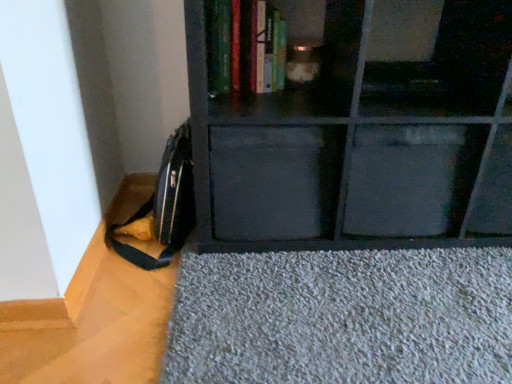
Find the location of `black matte drawer at center, positioned as the second drawer in right-to-left order`. black matte drawer at center, positioned as the second drawer in right-to-left order is located at coordinates (274, 181).

The height and width of the screenshot is (384, 512). In order to click on black matte drawer at center, positioned as the second drawer in right-to-left order in this screenshot , I will do `click(274, 181)`.

Who is taller, matte black shelf at center or black matte drawer at center, positioned as the first drawer in left-to-right order?

matte black shelf at center is taller.

From a real-world perspective, is matte black shelf at center positioned above or below black matte drawer at center, positioned as the second drawer in right-to-left order?

From a real-world perspective, matte black shelf at center is physically above black matte drawer at center, positioned as the second drawer in right-to-left order.

Choose the correct answer: Is matte black shelf at center inside black matte drawer at center, positioned as the second drawer in right-to-left order, or outside it?

The correct answer is: outside.

Considering the relative positions of matte black shelf at center and black matte drawer at center, positioned as the second drawer in right-to-left order, in the image provided, is matte black shelf at center to the right of black matte drawer at center, positioned as the second drawer in right-to-left order, from the viewer's perspective?

Yes, matte black shelf at center is to the right of black matte drawer at center, positioned as the second drawer in right-to-left order.

Is black matte drawer at center, positioned as the first drawer in left-to-right order, placed right next to hardcover book at upper center?

There is a gap between black matte drawer at center, positioned as the first drawer in left-to-right order, and hardcover book at upper center.

Does black matte drawer at center, positioned as the second drawer in right-to-left order, have a lesser height compared to hardcover book at upper center?

Incorrect, the height of black matte drawer at center, positioned as the second drawer in right-to-left order, does not fall short of that of hardcover book at upper center.

Does point (238, 130) appear closer or farther from the camera than point (226, 15)?

Point (238, 130) appears to be closer to the viewer than point (226, 15).

In the image, is black matte drawer at center, positioned as the second drawer in right-to-left order, on the left side or the right side of hardcover book at upper center?

black matte drawer at center, positioned as the second drawer in right-to-left order, is to the right of hardcover book at upper center.

Which is behind, hardcover book at upper center or metallic gray drawer at center, which is the second drawer in left-to-right order?

metallic gray drawer at center, which is the second drawer in left-to-right order.

Is hardcover book at upper center looking in the opposite direction of metallic gray drawer at center, which is the second drawer in left-to-right order?

No, hardcover book at upper center is not facing the opposite direction of metallic gray drawer at center, which is the second drawer in left-to-right order.

In the scene shown: Is hardcover book at upper center completely or partially outside of metallic gray drawer at center, arranged as the first drawer when viewed from the right?

hardcover book at upper center lies outside metallic gray drawer at center, arranged as the first drawer when viewed from the right,'s area.

Which object is closer to the camera, matte black shelf at center or hardcover book at upper center?

matte black shelf at center is in front.

From a real-world perspective, which object rests below the other?

matte black shelf at center.

Based on their positions, is matte black shelf at center located to the left or right of hardcover book at upper center?

From the image, it's evident that matte black shelf at center is to the right of hardcover book at upper center.

Does matte black shelf at center have a larger size compared to hardcover book at upper center?

Indeed, matte black shelf at center has a larger size compared to hardcover book at upper center.

In the scene shown: Which of these two, metallic gray drawer at center, arranged as the first drawer when viewed from the right, or matte black shelf at center, is wider?

matte black shelf at center is wider.

Are metallic gray drawer at center, arranged as the first drawer when viewed from the right, and matte black shelf at center located far from each other?

No.

Looking at this image, from a real-world perspective, is metallic gray drawer at center, arranged as the first drawer when viewed from the right, positioned above or below matte black shelf at center?

In terms of real-world spatial position, metallic gray drawer at center, arranged as the first drawer when viewed from the right, is below matte black shelf at center.

Considering the sizes of hardcover book at upper center and matte black shelf at center in the image, is hardcover book at upper center taller or shorter than matte black shelf at center?

Considering their sizes, hardcover book at upper center has less height than matte black shelf at center.

Which is more to the right, hardcover book at upper center or matte black shelf at center?

Positioned to the right is matte black shelf at center.

Where is `book behind the matte black shelf at center`? book behind the matte black shelf at center is located at coordinates (245, 47).

Is hardcover book at upper center oriented towards matte black shelf at center?

Yes, hardcover book at upper center is oriented towards matte black shelf at center.

Are matte black shelf at center and metallic gray drawer at center, arranged as the first drawer when viewed from the right, making contact?

matte black shelf at center and metallic gray drawer at center, arranged as the first drawer when viewed from the right, are clearly separated.

Locate an element on the screen. shelf above the metallic gray drawer at center, arranged as the first drawer when viewed from the right (from the image's perspective) is located at coordinates (360, 131).

Would you say matte black shelf at center is outside metallic gray drawer at center, which is the second drawer in left-to-right order?

Yes.

Is point (226, 154) positioned after point (454, 167)?

No, it is in front of (454, 167).

Locate an element on the screen. This screenshot has height=384, width=512. drawer that is the 1st object directly below the matte black shelf at center (from a real-world perspective) is located at coordinates (274, 181).

I want to click on drawer in front of the hardcover book at upper center, so click(274, 181).

Based on their spatial positions, is metallic gray drawer at center, arranged as the first drawer when viewed from the right, or hardcover book at upper center further from black matte drawer at center, positioned as the second drawer in right-to-left order?

hardcover book at upper center is further to black matte drawer at center, positioned as the second drawer in right-to-left order.

Looking at the image, which one is located further to metallic gray drawer at center, arranged as the first drawer when viewed from the right, matte black shelf at center or black matte drawer at center, positioned as the first drawer in left-to-right order?

Among the two, black matte drawer at center, positioned as the first drawer in left-to-right order, is located further to metallic gray drawer at center, arranged as the first drawer when viewed from the right.

Looking at the image, which one is located closer to hardcover book at upper center, metallic gray drawer at center, arranged as the first drawer when viewed from the right, or black matte drawer at center, positioned as the first drawer in left-to-right order?

Based on the image, black matte drawer at center, positioned as the first drawer in left-to-right order, appears to be nearer to hardcover book at upper center.

Estimate the real-world distances between objects in this image. Which object is closer to matte black shelf at center, hardcover book at upper center or black matte drawer at center, positioned as the first drawer in left-to-right order?

black matte drawer at center, positioned as the first drawer in left-to-right order, is positioned closer to the anchor matte black shelf at center.

When comparing their distances from metallic gray drawer at center, which is the second drawer in left-to-right order, does matte black shelf at center or hardcover book at upper center seem closer?

matte black shelf at center.

Based on their spatial positions, is matte black shelf at center or hardcover book at upper center closer to black matte drawer at center, positioned as the first drawer in left-to-right order?

matte black shelf at center.

Based on their spatial positions, is hardcover book at upper center or matte black shelf at center closer to black matte drawer at center, positioned as the first drawer in left-to-right order?

Among the two, matte black shelf at center is located nearer to black matte drawer at center, positioned as the first drawer in left-to-right order.

From the image, which object appears to be nearer to matte black shelf at center, hardcover book at upper center or metallic gray drawer at center, arranged as the first drawer when viewed from the right?

metallic gray drawer at center, arranged as the first drawer when viewed from the right, lies closer to matte black shelf at center than the other object.

Locate an element on the screen. drawer between hardcover book at upper center and matte black shelf at center in the horizontal direction is located at coordinates (274, 181).

This screenshot has height=384, width=512. In order to click on shelf situated between hardcover book at upper center and metallic gray drawer at center, which is the second drawer in left-to-right order, from left to right in this screenshot , I will do `click(360, 131)`.

The height and width of the screenshot is (384, 512). Find the location of `shelf between black matte drawer at center, positioned as the second drawer in right-to-left order, and metallic gray drawer at center, which is the second drawer in left-to-right order`. shelf between black matte drawer at center, positioned as the second drawer in right-to-left order, and metallic gray drawer at center, which is the second drawer in left-to-right order is located at coordinates (360, 131).

Find the location of a particular element. Image resolution: width=512 pixels, height=384 pixels. drawer between hardcover book at upper center and metallic gray drawer at center, which is the second drawer in left-to-right order, in the horizontal direction is located at coordinates (274, 181).